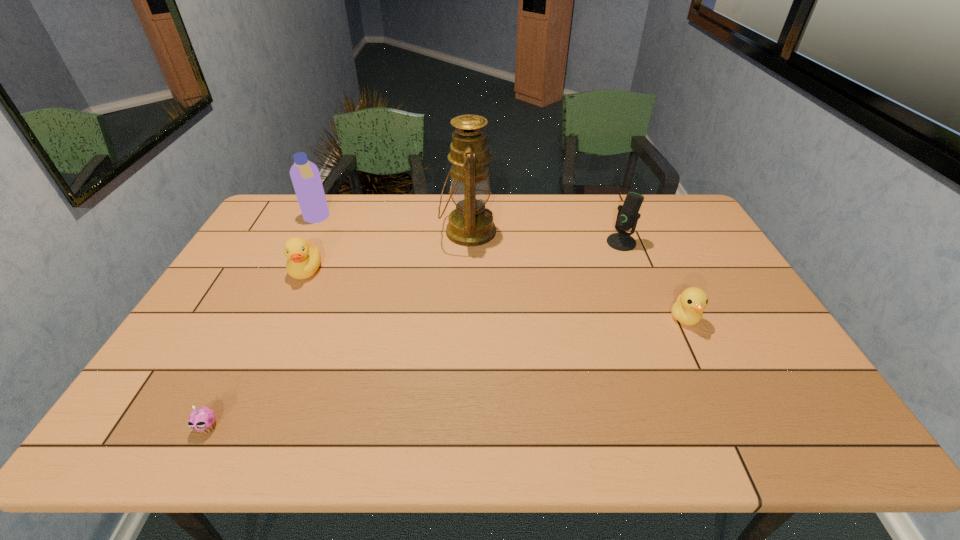
Where is `the fourth object from left to right`? The height and width of the screenshot is (540, 960). the fourth object from left to right is located at coordinates click(x=471, y=224).

The height and width of the screenshot is (540, 960). In order to click on oil lamp in this screenshot , I will do `click(471, 224)`.

This screenshot has width=960, height=540. Find the location of `shampoo`. shampoo is located at coordinates (305, 176).

Identify the location of the second object from right to left. This screenshot has height=540, width=960. (627, 217).

Identify the location of microphone. The height and width of the screenshot is (540, 960). (627, 217).

This screenshot has height=540, width=960. In order to click on the farther duck in this screenshot , I will do `click(304, 258)`.

Locate an element on the screen. The width and height of the screenshot is (960, 540). the fourth farthest object is located at coordinates (304, 258).

Find the location of a particular element. This screenshot has width=960, height=540. the right duck is located at coordinates (688, 309).

Find the location of a particular element. the nearer duck is located at coordinates (688, 309).

The width and height of the screenshot is (960, 540). Find the location of `the nearest object`. the nearest object is located at coordinates (202, 419).